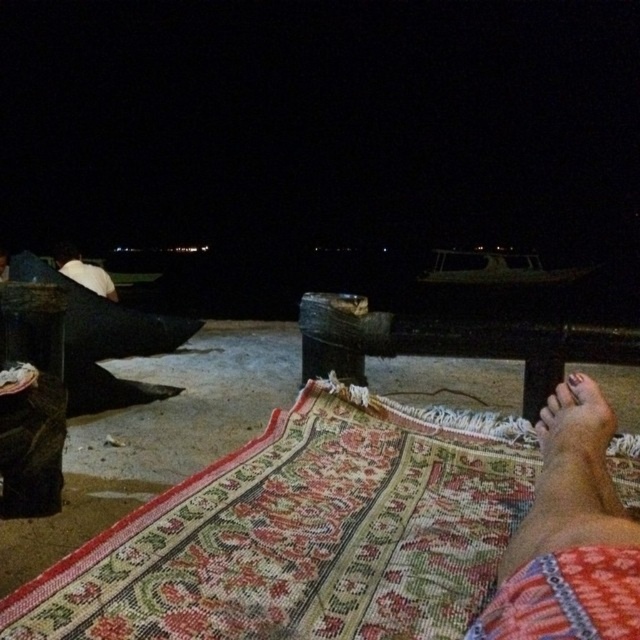
You are a photographer trying to capture the brown textured foot at lower right in your shot. Based on its 2D coordinates, where should you position your camera to ensure it is centered in the frame?

To center the brown textured foot at lower right in your frame, position your camera so that the foot is at the center point of the image, which corresponds to the coordinates provided at point (576, 452).

You are a photographer trying to capture both the brown textured foot at lower right and the white matte umbrella at upper left in the same frame. Which object should you adjust your camera to focus on first to ensure both are in the frame?

You should focus on the brown textured foot at lower right first because it is shorter than the white matte umbrella at upper left, so adjusting the frame to include the shorter object first ensures the taller one will also be captured.